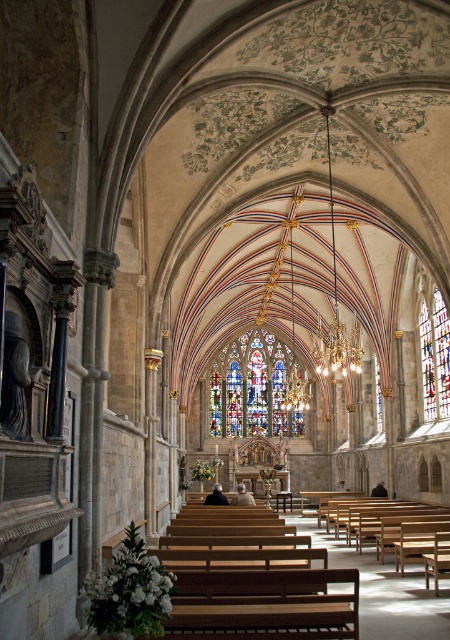
Question: Among these points, which one is nearest to the camera?

Choices:
 (A) (446, 406)
 (B) (274, 364)

Answer: (A)

Question: Which point appears farthest from the camera in this image?

Choices:
 (A) (279, 381)
 (B) (431, 385)

Answer: (A)

Question: Is stained glass at center below multicolored stained glass at right?

Choices:
 (A) yes
 (B) no

Answer: (A)

Question: Does stained glass at center appear over multicolored stained glass at right?

Choices:
 (A) yes
 (B) no

Answer: (B)

Question: Can you confirm if stained glass at center is bigger than multicolored stained glass at right?

Choices:
 (A) no
 (B) yes

Answer: (B)